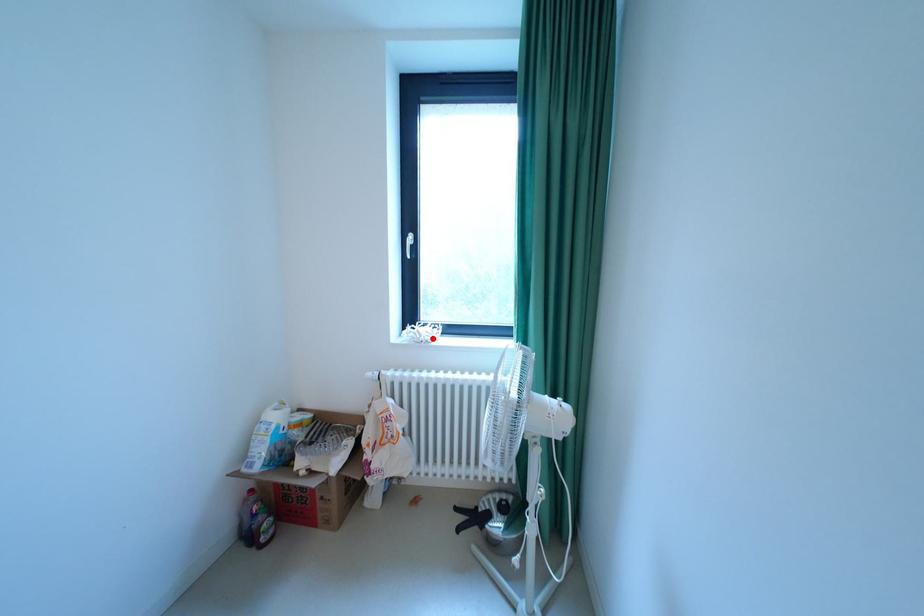
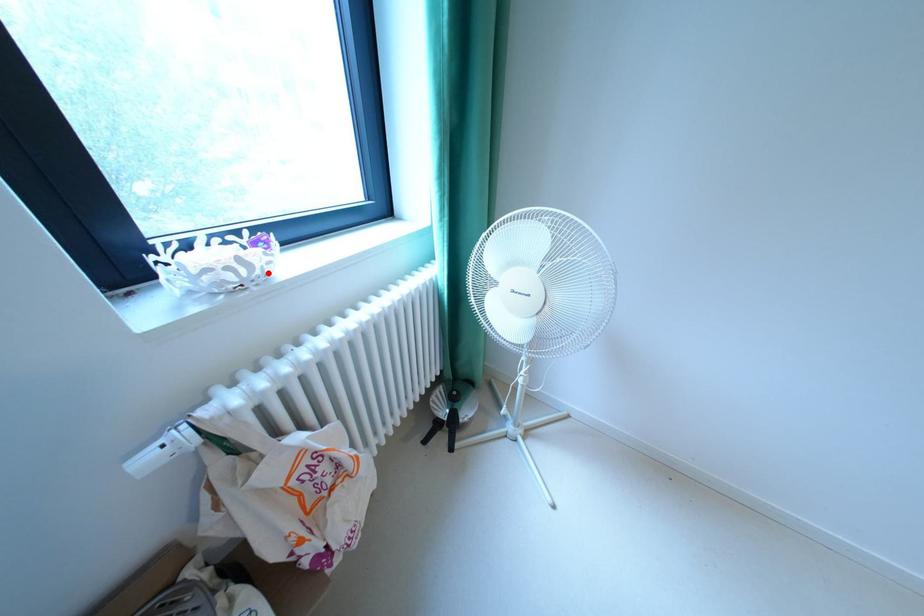
I am providing you with two images of the same scene from different viewpoints. A red point is marked on the first image and another point is marked on the second image. Does the point marked in image1 correspond to the same location as the one in image2?

Yes